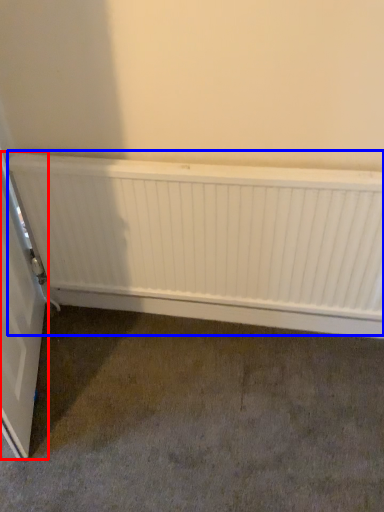
Question: Among these objects, which one is farthest to the camera, door (highlighted by a red box) or radiator (highlighted by a blue box)?

Choices:
 (A) door
 (B) radiator

Answer: (B)